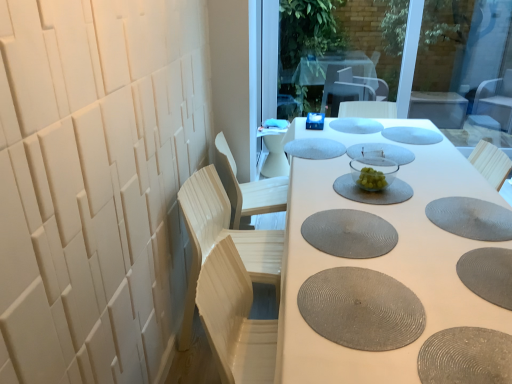
The image size is (512, 384). What are the coordinates of `vacant space in front of gray textured placemat at center, placed as the seventh manhole cover when sorted from back to front` in the screenshot? It's located at (368, 278).